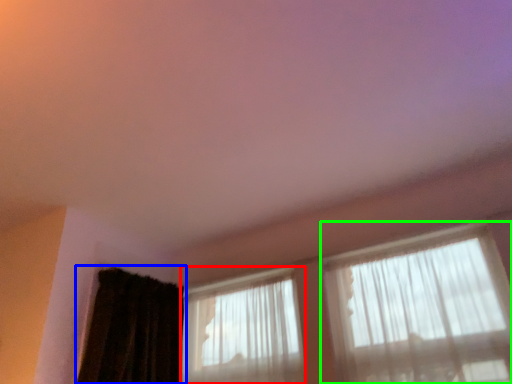
Question: Which is farther away from window (highlighted by a red box)? curtain (highlighted by a blue box) or window (highlighted by a green box)?

Choices:
 (A) curtain
 (B) window

Answer: (B)